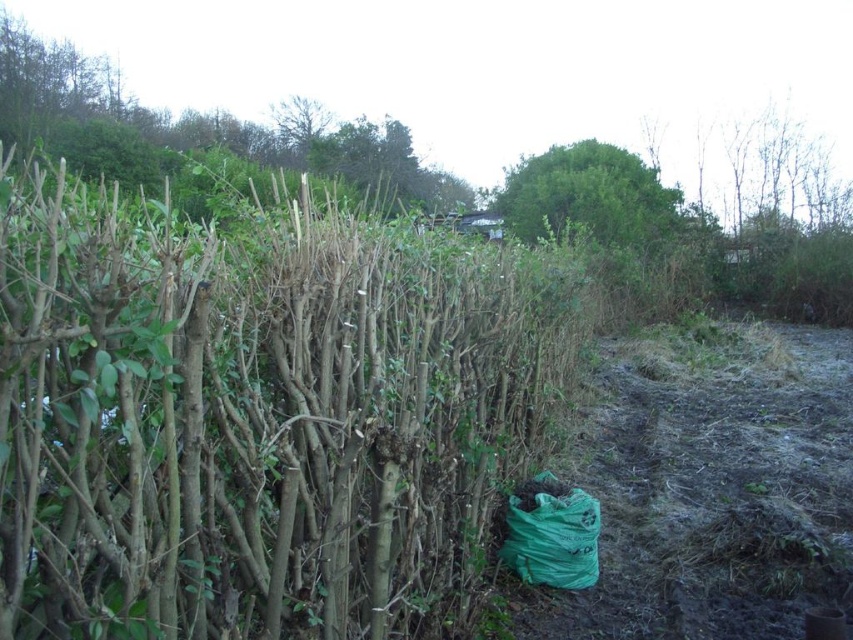
Question: Which of the following is the farthest from the observer?

Choices:
 (A) green leafy tree at upper left
 (B) green fabric bag at lower center

Answer: (A)

Question: Which object is farther from the camera taking this photo?

Choices:
 (A) green fabric bag at lower center
 (B) green leafy tree at upper left

Answer: (B)

Question: From the image, what is the correct spatial relationship of green fabric bag at lower center in relation to green leafy tree at upper left?

Choices:
 (A) right
 (B) left

Answer: (A)

Question: Is green fabric bag at lower center closer to the viewer compared to green leafy tree at upper left?

Choices:
 (A) no
 (B) yes

Answer: (B)

Question: Does green fabric bag at lower center appear over green leafy tree at upper left?

Choices:
 (A) no
 (B) yes

Answer: (A)